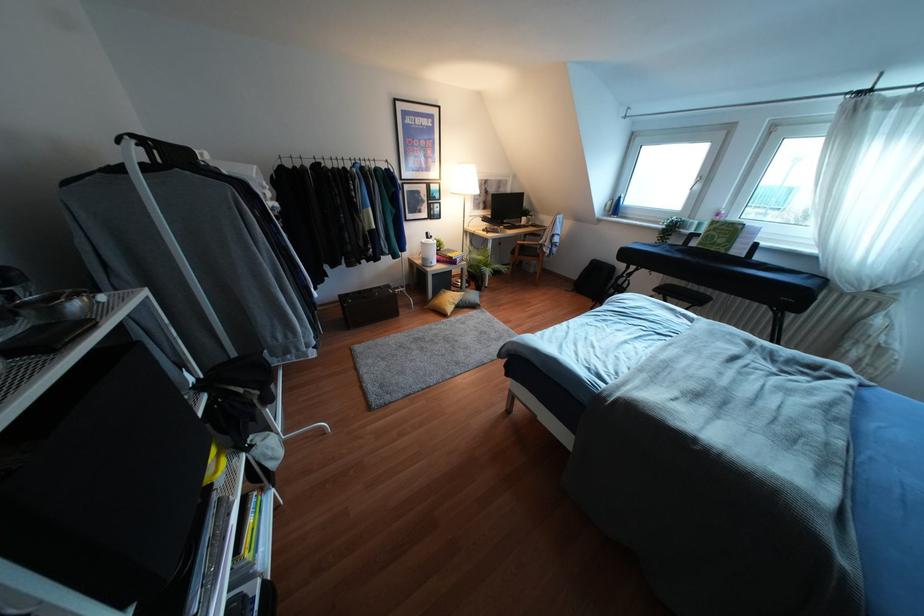
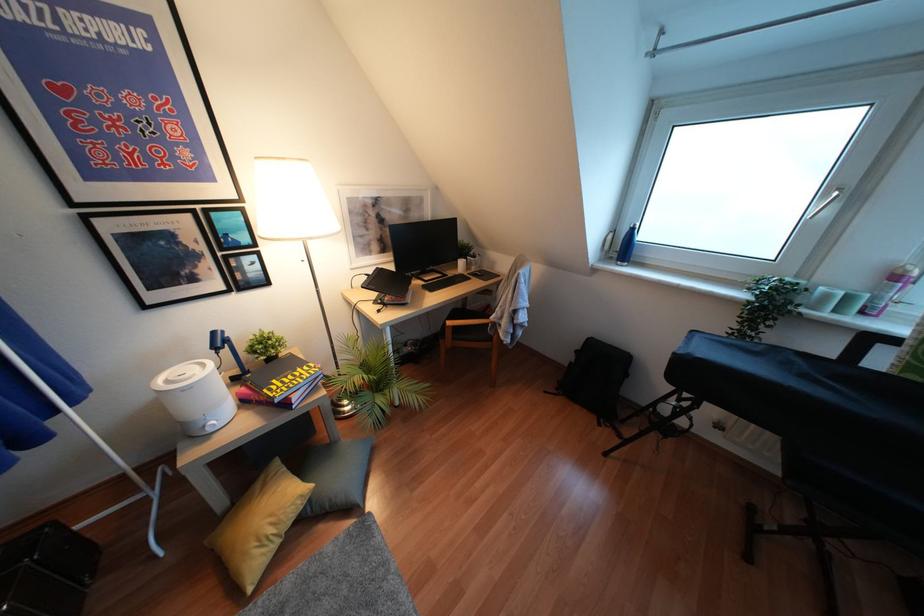
In the second image, find the point that corresponds to point (614, 208) in the first image.

(623, 246)